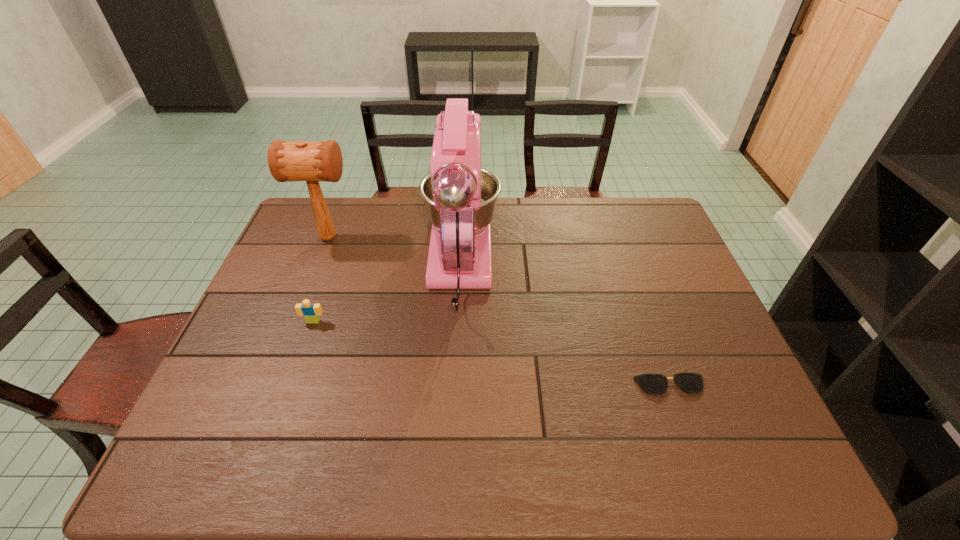
This screenshot has height=540, width=960. Identify the location of vacant space located 0.140m on the left of the nearest object. (578, 386).

Locate an element on the screen. mixer located in the far edge section of the desktop is located at coordinates (460, 197).

You are a GUI agent. You are given a task and a screenshot of the screen. Output one action in this format:
    pyautogui.click(x=<x>, y=<y>)
    Task: Click on the mallet located at the far edge
    The width and height of the screenshot is (960, 540).
    Given the screenshot: What is the action you would take?
    pyautogui.click(x=312, y=162)

Locate an element on the screen. mallet situated at the left edge is located at coordinates (312, 162).

Locate an element on the screen. Lego present at the left edge is located at coordinates (311, 312).

I want to click on object that is at the right edge, so click(656, 384).

I want to click on object positioned at the far left corner, so click(312, 162).

In the image, there is a desktop. At what (x,y) coordinates should I click in order to perform the action: click on blank space at the far edge. Please return your answer as a coordinate pair (x, y). Looking at the image, I should click on (379, 225).

This screenshot has height=540, width=960. I want to click on vacant space at the near edge of the desktop, so click(502, 476).

Where is `blank space at the left edge of the desktop`? The height and width of the screenshot is (540, 960). blank space at the left edge of the desktop is located at coordinates (286, 241).